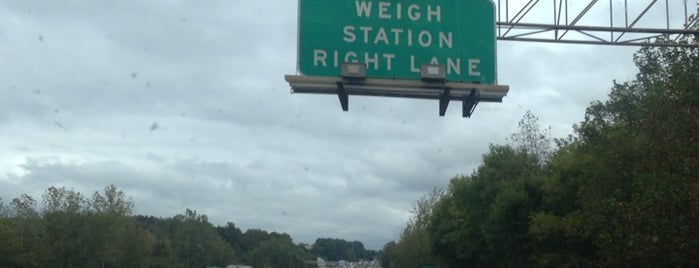
In order to click on lights in this screenshot , I will do `click(442, 70)`, `click(349, 79)`.